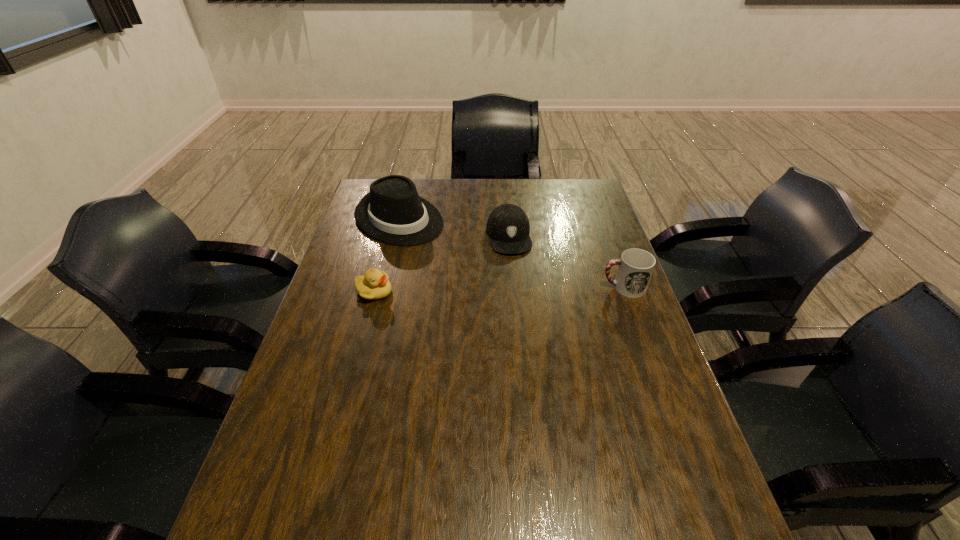
Locate an element on the screen. The width and height of the screenshot is (960, 540). blank space located on the front-facing side of the cap is located at coordinates (521, 301).

Where is `free space located on the front-facing side of the tallest object`? free space located on the front-facing side of the tallest object is located at coordinates (451, 256).

You are a GUI agent. You are given a task and a screenshot of the screen. Output one action in this format:
    pyautogui.click(x=<x>, y=<y>)
    Task: Click on the free location located 0.200m on the front-facing side of the tallest object
    
    Given the screenshot: What is the action you would take?
    pyautogui.click(x=466, y=266)

I want to click on free spot located on the front-facing side of the tallest object, so click(498, 289).

The height and width of the screenshot is (540, 960). Identify the location of object that is at the far edge. (392, 212).

Locate an element on the screen. The height and width of the screenshot is (540, 960). duckling that is at the left edge is located at coordinates (374, 285).

Find the location of a particular element. This screenshot has height=540, width=960. fedora that is at the left edge is located at coordinates (392, 212).

What are the coordinates of `object located at the right edge` in the screenshot? It's located at (635, 268).

I want to click on object present at the far left corner, so click(x=392, y=212).

Where is `vacant space at the far edge of the desktop`? The height and width of the screenshot is (540, 960). vacant space at the far edge of the desktop is located at coordinates (519, 200).